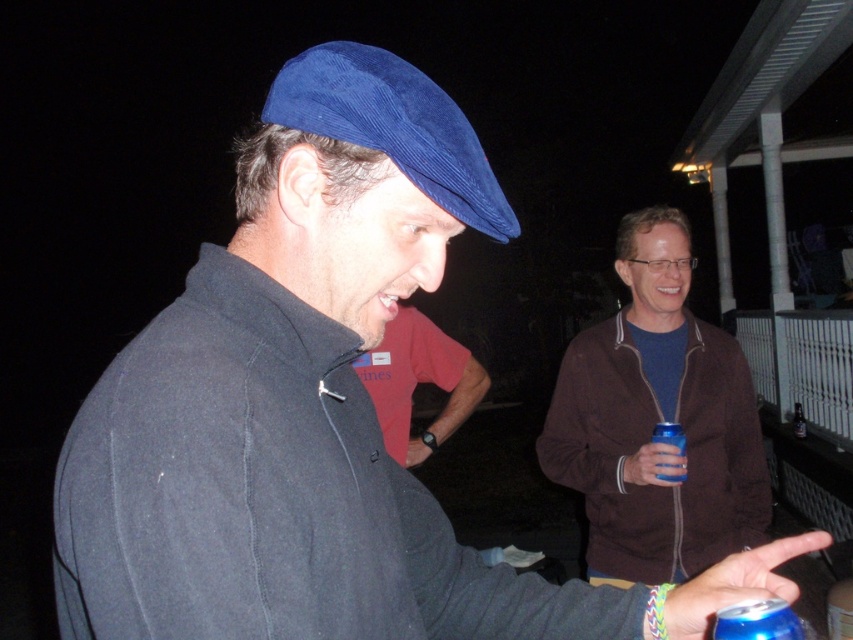
Question: In this image, where is blue plastic cup at right located relative to translucent plastic bottle at right?

Choices:
 (A) above
 (B) below

Answer: (A)

Question: Based on their relative distances, which object is farther from the blue metallic can at lower right?

Choices:
 (A) red cotton t-shirt at center
 (B) blue plastic cup at right
 (C) brown fleece jacket at upper right

Answer: (C)

Question: Which of the following is the farthest from the observer?

Choices:
 (A) blue metallic can at lower right
 (B) red cotton t-shirt at center

Answer: (B)

Question: Is velvet blue cap at center bigger than red cotton t-shirt at center?

Choices:
 (A) no
 (B) yes

Answer: (A)

Question: Is brown fleece jacket at upper right bigger than velvet blue cap at center?

Choices:
 (A) yes
 (B) no

Answer: (A)

Question: Based on their relative distances, which object is farther from the blue plastic cup at right?

Choices:
 (A) blue metallic can at lower right
 (B) red cotton t-shirt at center

Answer: (A)